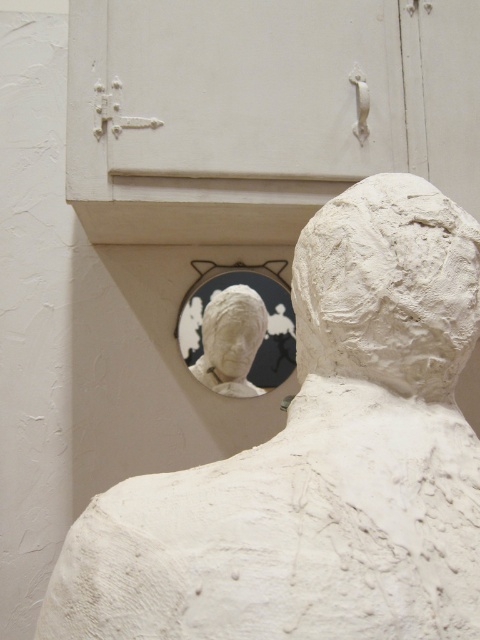
Which is more to the left, white clay bust at upper center or white clay head at center?

Positioned to the left is white clay bust at upper center.

Is point (335, 502) positioned before point (396, 180)?

Yes, it is.

I want to click on white clay bust at upper center, so click(317, 461).

Between point (240, 292) and point (212, 300), which one is positioned in front?

Point (212, 300)

Who is more forward, (204,296) or (239,352)?

Point (239,352) is in front.

Locate an element on the screen. white glossy mirror at center is located at coordinates [238, 326].

Is white clay head at center taller than white plaster bust at center?

Correct, white clay head at center is much taller as white plaster bust at center.

The width and height of the screenshot is (480, 640). What do you see at coordinates (387, 288) in the screenshot? I see `white clay head at center` at bounding box center [387, 288].

Who is more forward, (371, 333) or (210, 356)?

Point (371, 333) is more forward.

At what (x,y) coordinates should I click in order to perform the action: click on white clay head at center. Please return your answer as a coordinate pair (x, y). Looking at the image, I should click on (387, 288).